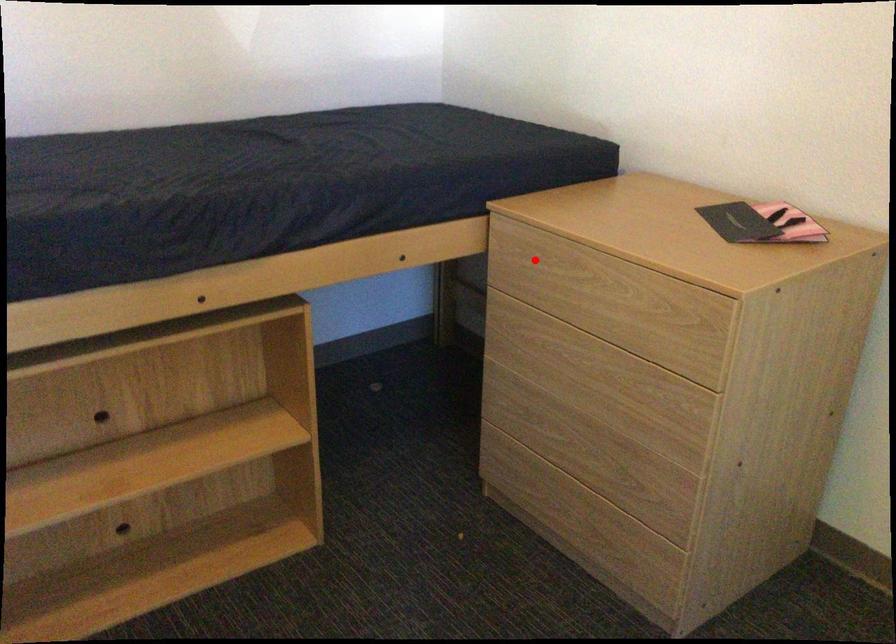
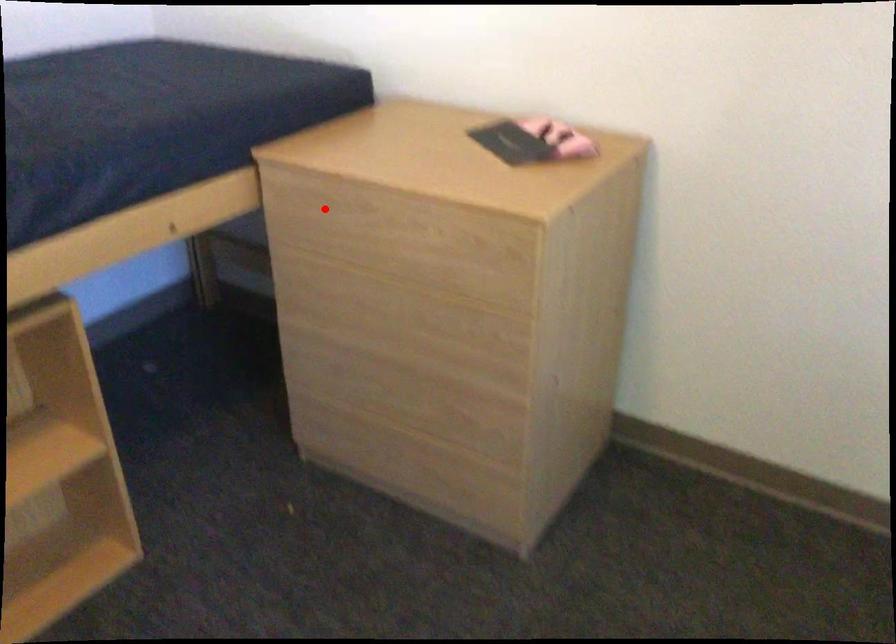
I am providing you with two images of the same scene from different viewpoints. A red point is marked on the first image and another point is marked on the second image. Is the red point in image1 aligned with the point shown in image2?

Yes